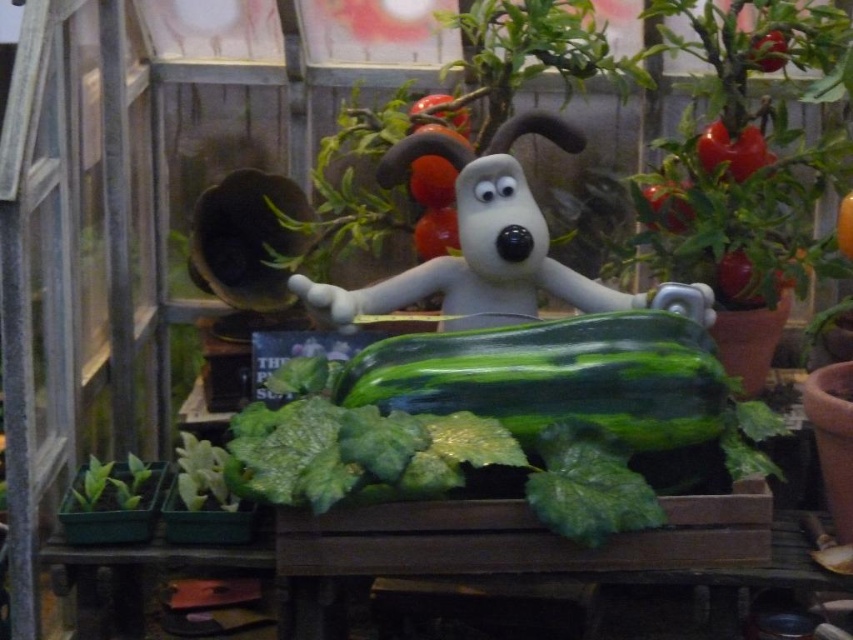
You are a gardener who wants to plant a new flowerpot between the green matte cucumber at center and the green leafy at lower left. Based on their positions, where should you place the new flowerpot?

The green matte cucumber at center is positioned on the right side of green leafy at lower left, so you should place the new flowerpot between them, to the right of the green leafy at lower left and to the left of the green matte cucumber at center.

You are a gardener trying to water the plants in the greenhouse. You have a watering can that can only reach plants in front of the green matte cucumber at center. Can you water the green leafy at lower left?

The green leafy at lower left is behind the green matte cucumber at center, so it cannot be reached by the watering can which only reaches plants in front of the green matte cucumber at center.

You are a gardener who wants to place a new plant pot between the green matte cucumber at center and the white matte dog at center. Which side of the path between them has more space for the pot?

The white matte dog at center has more space on its side because the green matte cucumber at center is narrower, so placing the pot closer to the white matte dog at center would allow more space.